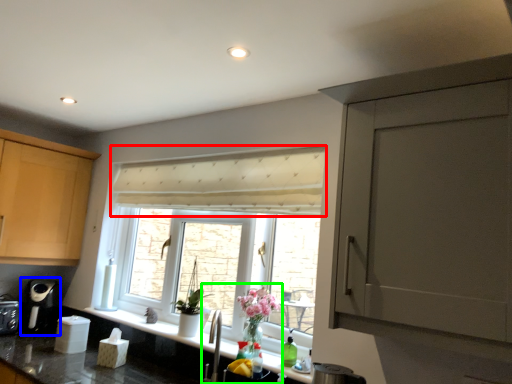
Question: Considering the real-world distances, which object is farthest from curtain (highlighted by a red box)? coffee machine (highlighted by a blue box) or sink (highlighted by a green box)?

Choices:
 (A) coffee machine
 (B) sink

Answer: (A)